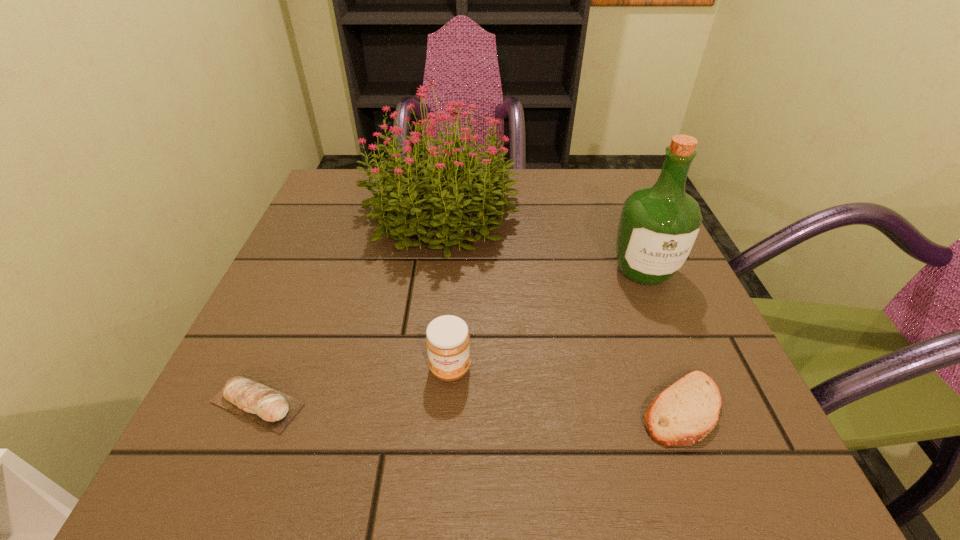
In the image, there is a desktop. Identify the location of vacant space at the near edge. (458, 431).

You are a GUI agent. You are given a task and a screenshot of the screen. Output one action in this format:
    pyautogui.click(x=<x>, y=<y>)
    Task: Click on the free space at the left edge of the desktop
    Image resolution: width=960 pixels, height=540 pixels.
    Given the screenshot: What is the action you would take?
    pyautogui.click(x=300, y=293)

I want to click on free spot at the right edge of the desktop, so click(617, 265).

In the image, there is a desktop. Where is `vacant space at the far left corner`? The width and height of the screenshot is (960, 540). vacant space at the far left corner is located at coordinates (327, 217).

I want to click on vacant space at the far right corner of the desktop, so click(621, 194).

The height and width of the screenshot is (540, 960). What are the coordinates of `free spot at the near right corner of the desktop` in the screenshot? It's located at (684, 459).

Find the location of `vacant space in between the liquor and the bouquet`. vacant space in between the liquor and the bouquet is located at coordinates (542, 241).

This screenshot has width=960, height=540. I want to click on free spot between the shortest object and the third shortest object, so click(x=565, y=389).

I want to click on empty space that is in between the taller pita bread and the third tallest object, so point(354,386).

Identify the location of vacant space that is in between the third shortest object and the bouquet. (445, 291).